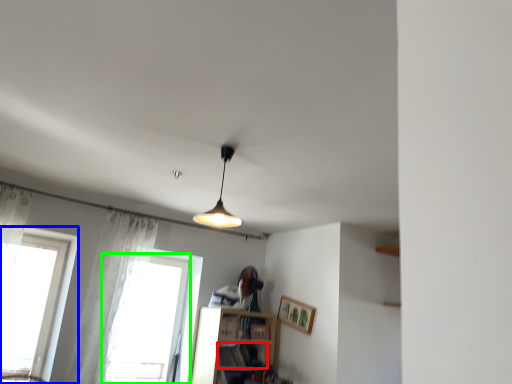
Question: Estimate the real-world distances between objects in this image. Which object is farther from book (highlighted by a red box), window (highlighted by a blue box) or window (highlighted by a green box)?

Choices:
 (A) window
 (B) window

Answer: (A)